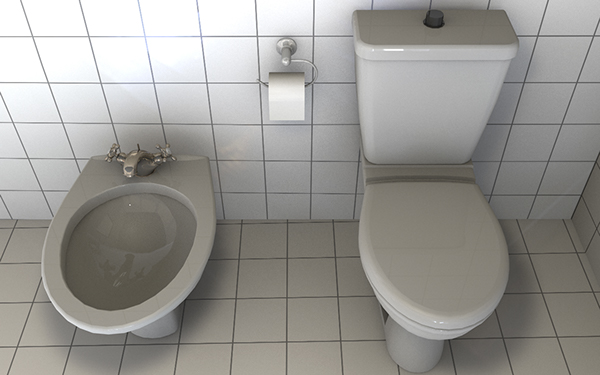
Identify the location of toilet lid. (425, 259).